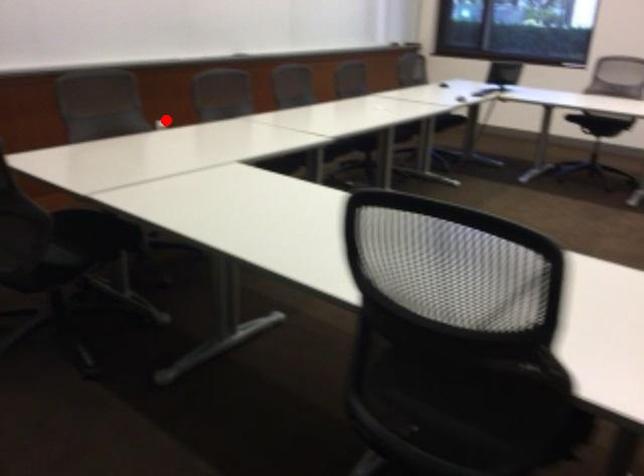
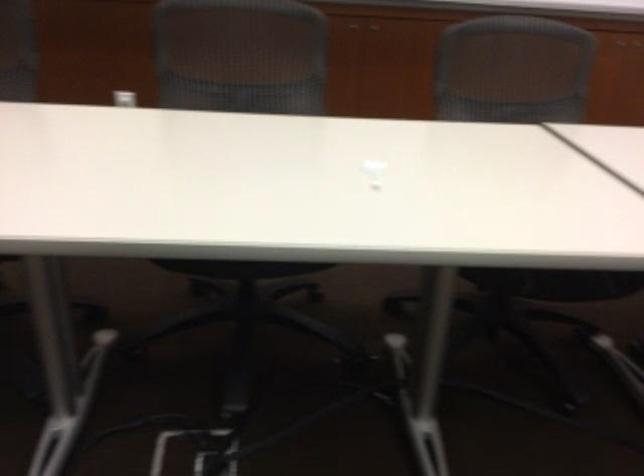
The point at the highlighted location is marked in the first image. Where is the corresponding point in the second image?

(125, 96)